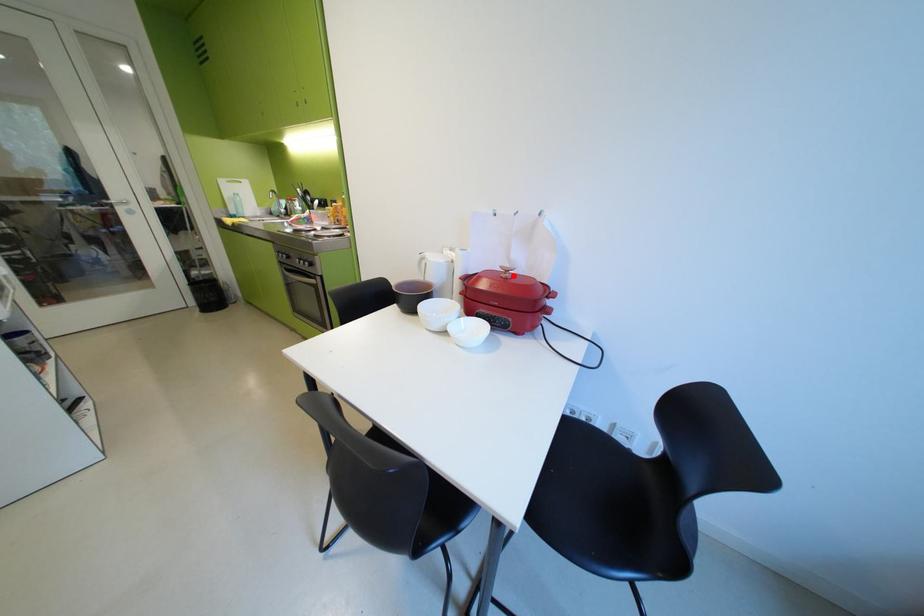
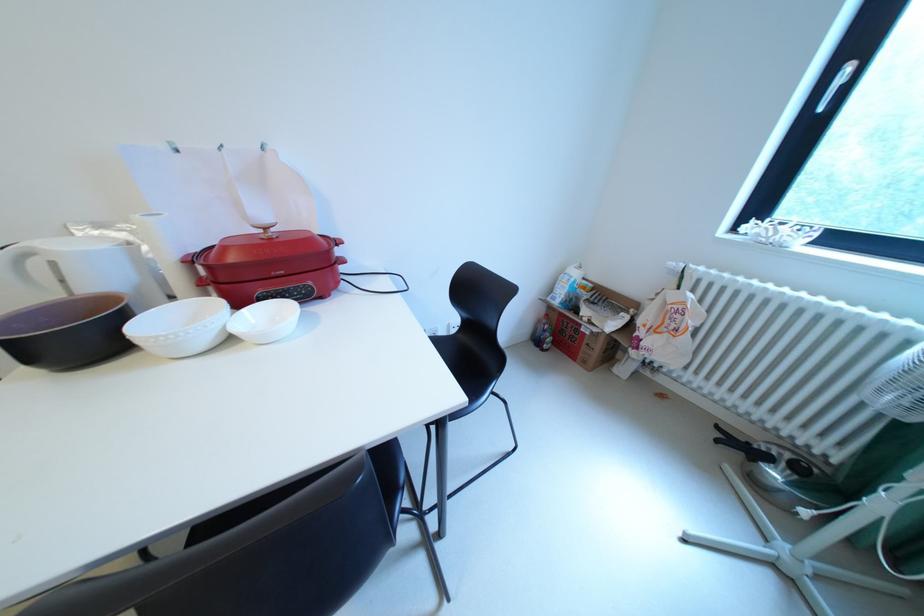
In the second image, find the point that corresponds to the highlighted location in the first image.

(273, 237)